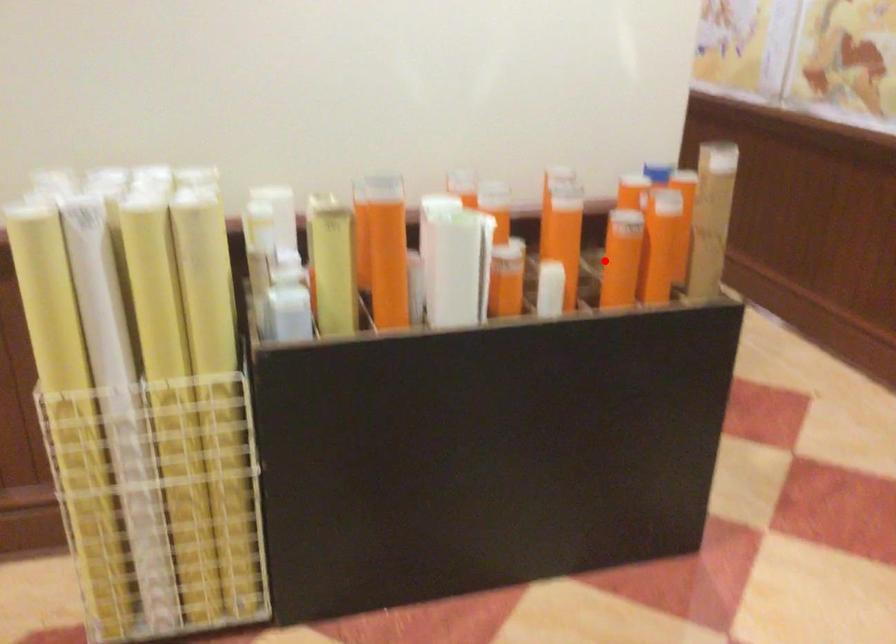
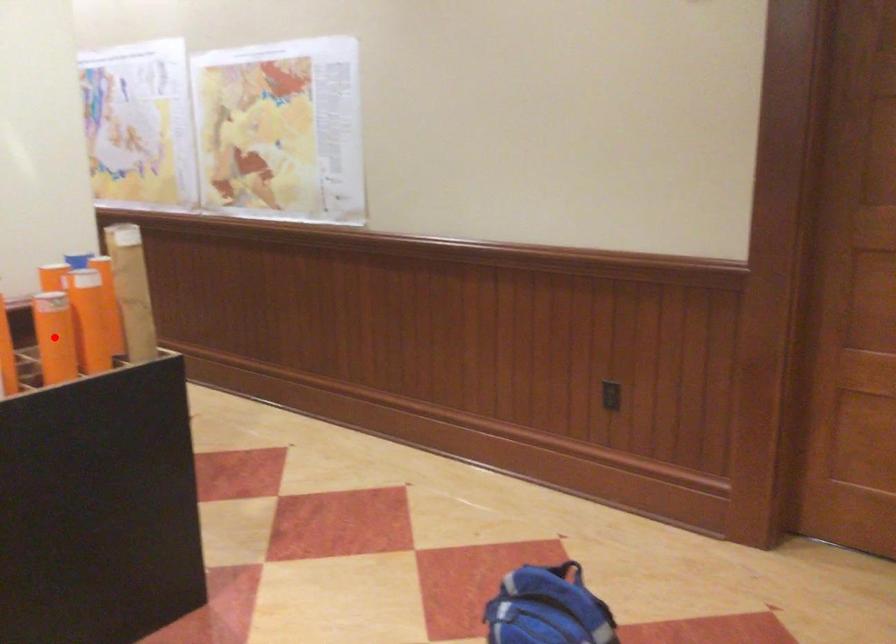
I am providing you with two images of the same scene from different viewpoints. A red point is marked on the first image and another point is marked on the second image. Are the points marked in image1 and image2 representing the same 3D position?

Yes